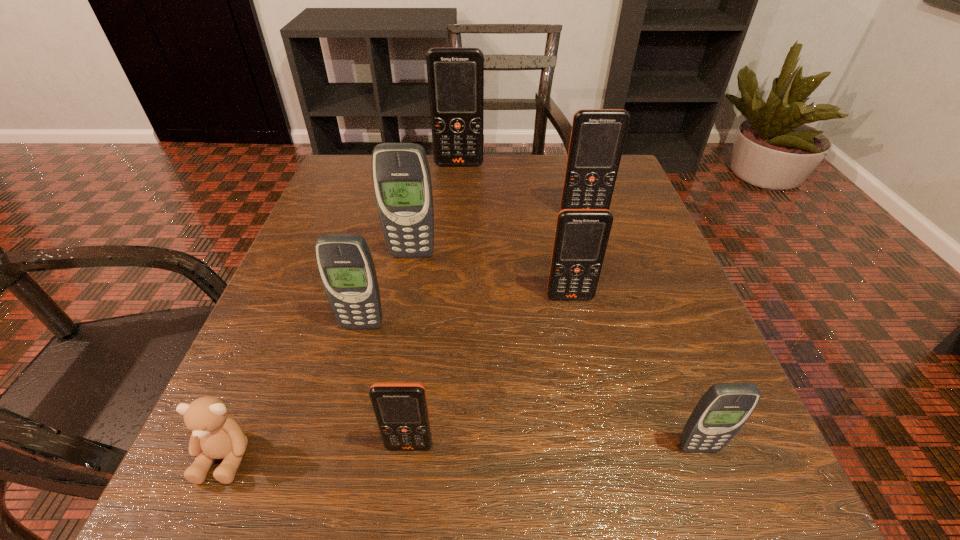
The image size is (960, 540). I want to click on the smallest orange cellular telephone, so click(x=401, y=410).

I want to click on the nearest gray cellular telephone, so click(x=721, y=412).

I want to click on the rightmost gray cellular telephone, so (x=721, y=412).

Identify the location of brown teddy bear. pyautogui.click(x=215, y=435).

Locate an element on the screen. This screenshot has width=960, height=540. teddy bear is located at coordinates (215, 435).

Where is `free point located 0.200m on the screen of the biggest orange cellular telephone`? This screenshot has height=540, width=960. free point located 0.200m on the screen of the biggest orange cellular telephone is located at coordinates (456, 215).

At what (x,y) coordinates should I click in order to perform the action: click on vacant space positioned on the screen of the third nearest orange cellular telephone. Please return your answer as a coordinate pair (x, y). Looking at the image, I should click on (623, 344).

This screenshot has height=540, width=960. I want to click on vacant region located 0.050m on the screen of the biggest gray cellular telephone, so click(x=408, y=276).

Locate an element on the screen. free space located on the screen of the fifth farthest object is located at coordinates tap(324, 475).

The width and height of the screenshot is (960, 540). I want to click on free location located on the screen of the second smallest orange cellular telephone, so [x=611, y=490].